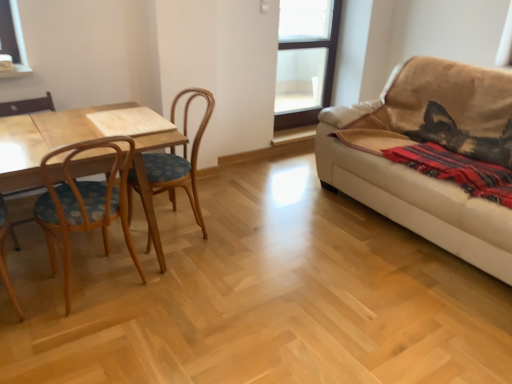
Locate an element on the screen. Image resolution: width=512 pixels, height=384 pixels. vacant location behind wooden chair at left is located at coordinates (47, 253).